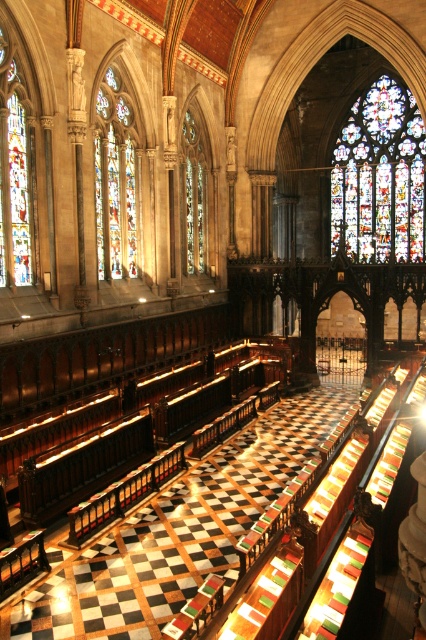
Looking at this image, you are standing in the cathedral and want to take a photo of both the stained glass at upper center and the stained glass window at left. Given that your camera has a maximum focus range of 50 meters, will you be able to capture both in a single shot without moving closer?

The stained glass at upper center is 50.92 meters away from the stained glass window at left. Since the distance between them exceeds the camera maximum focus range of 50 meters, you will not be able to capture both in a single shot without moving closer.

Consider the image. You are standing at the entrance of the cathedral and want to take a photo of the stained glass at upper center without the stained glass window at center blocking the view. Is this possible?

The stained glass window at center is behind the stained glass at upper center, so you can take a photo of the stained glass at upper center without the stained glass window at center blocking the view.

You are standing at the entrance of the cathedral and want to find the stained glass window at center and the stained glass window at left. Based on their positions, which one is closer to your right side?

The stained glass window at center is positioned on the right side of stained glass window at left, so the stained glass window at center is closer to your right side.